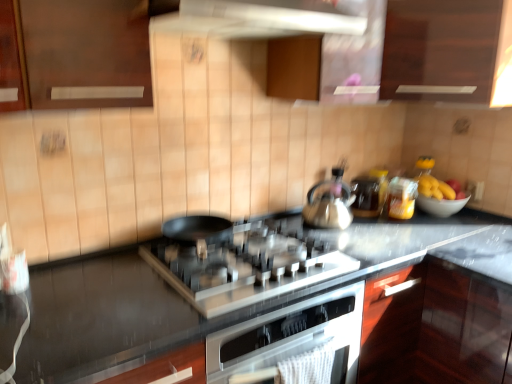
In order to face white glossy bowl at right, should I rotate leftwards or rightwards?

To face it directly, rotate right by 23.308 degrees.

Locate an element on the screen. satin silver gas stove at center is located at coordinates (246, 266).

The image size is (512, 384). What do you see at coordinates (367, 45) in the screenshot?
I see `wooden cabinet at upper center, which is counted as the second cabinetry, starting from the right` at bounding box center [367, 45].

This screenshot has height=384, width=512. Describe the element at coordinates (402, 198) in the screenshot. I see `matte yellow jar at upper right, the 2th appliance in the left-to-right sequence` at that location.

Describe the element at coordinates (330, 203) in the screenshot. I see `satin silver kettle at center` at that location.

How much space does matte glass jar at center, acting as the first appliance starting from the left, occupy horizontally?

The width of matte glass jar at center, acting as the first appliance starting from the left, is 6.06 inches.

At what (x,y) coordinates should I click in order to perform the action: click on white glossy bowl at right. Please return your answer as a coordinate pair (x, y). Image resolution: width=512 pixels, height=384 pixels. Looking at the image, I should click on (441, 205).

Between point (290, 250) and point (83, 63), which one is positioned behind?

The point (290, 250) is behind.

Identify the location of gas stove lying below the wooden cabinet at upper center, which is counted as the second cabinetry, starting from the right (from the image's perspective). Image resolution: width=512 pixels, height=384 pixels. tap(246, 266).

From the image's perspective, which is above, satin silver gas stove at center or wooden cabinet at upper center, the 1th cabinetry viewed from the left?

wooden cabinet at upper center, the 1th cabinetry viewed from the left.

Is satin silver gas stove at center to the left or to the right of wooden cabinet at upper center, which is counted as the second cabinetry, starting from the right, in the image?

satin silver gas stove at center is to the right of wooden cabinet at upper center, which is counted as the second cabinetry, starting from the right.

Considering the sizes of dark wood cabinet at upper center, acting as the 2th cabinetry starting from the left, and white glossy exhaust hood at upper center in the image, is dark wood cabinet at upper center, acting as the 2th cabinetry starting from the left, wider or thinner than white glossy exhaust hood at upper center?

Considering their sizes, dark wood cabinet at upper center, acting as the 2th cabinetry starting from the left, looks broader than white glossy exhaust hood at upper center.

Is white glossy exhaust hood at upper center located within dark wood cabinet at upper center, acting as the 2th cabinetry starting from the left?

That's incorrect, white glossy exhaust hood at upper center is not inside dark wood cabinet at upper center, acting as the 2th cabinetry starting from the left.

Considering the positions of points (423, 30) and (181, 16), is point (423, 30) closer to camera compared to point (181, 16)?

That is False.

Is dark wood cabinet at upper center, acting as the 2th cabinetry starting from the left, beside wooden cabinet at upper center, which is counted as the second cabinetry, starting from the right?

Yes, dark wood cabinet at upper center, acting as the 2th cabinetry starting from the left, and wooden cabinet at upper center, which is counted as the second cabinetry, starting from the right, clearly make contact.

From the image's perspective, is dark wood cabinet at upper center, acting as the 2th cabinetry starting from the left, positioned above or below wooden cabinet at upper center, the 1th cabinetry viewed from the left?

dark wood cabinet at upper center, acting as the 2th cabinetry starting from the left, is situated higher than wooden cabinet at upper center, the 1th cabinetry viewed from the left, in the image.

Looking at this image, how different are the orientations of dark wood cabinet at upper center, acting as the 2th cabinetry starting from the left, and wooden cabinet at upper center, the 1th cabinetry viewed from the left, in degrees?

The angle between the facing direction of dark wood cabinet at upper center, acting as the 2th cabinetry starting from the left, and the facing direction of wooden cabinet at upper center, the 1th cabinetry viewed from the left, is 2.08e-05 degrees.

Is dark wood cabinet at upper center, acting as the first cabinetry starting from the right, positioned with its back to wooden cabinet at upper center, which is counted as the second cabinetry, starting from the right?

That's not correct — dark wood cabinet at upper center, acting as the first cabinetry starting from the right, is not looking away from wooden cabinet at upper center, which is counted as the second cabinetry, starting from the right.

Which object is thinner, white glossy bowl at right or dark wood cabinet at upper center, acting as the first cabinetry starting from the right?

white glossy bowl at right is thinner.

From a real-world perspective, which is physically below, white glossy bowl at right or dark wood cabinet at upper center, acting as the first cabinetry starting from the right?

white glossy bowl at right, from a real-world perspective.

Considering the positions of point (420, 200) and point (305, 86), is point (420, 200) closer or farther from the camera than point (305, 86)?

Point (420, 200) appears to be farther away from the viewer than point (305, 86).

Is white glossy bowl at right facing away from dark wood cabinet at upper center, acting as the 2th cabinetry starting from the left?

No.

Between matte glass jar at center, which is counted as the 2th appliance, starting from the right, and white glossy bowl at right, which one has less height?

With less height is white glossy bowl at right.

Is matte glass jar at center, acting as the first appliance starting from the left, next to white glossy bowl at right and touching it?

No, matte glass jar at center, acting as the first appliance starting from the left, is not beside white glossy bowl at right.

Is matte glass jar at center, acting as the first appliance starting from the left, looking in the opposite direction of white glossy bowl at right?

matte glass jar at center, acting as the first appliance starting from the left, does not have its back to white glossy bowl at right.

You are a GUI agent. You are given a task and a screenshot of the screen. Output one action in this format:
    pyautogui.click(x=<x>, y=<y>)
    Task: Click on the 2nd appliance counting from the left side of the white glossy bowl at right
    The height and width of the screenshot is (384, 512).
    Given the screenshot: What is the action you would take?
    pyautogui.click(x=366, y=196)

Is matte yellow jar at upper right, the 2th appliance in the left-to-right sequence, taller than satin silver kettle at center?

Yes.

The image size is (512, 384). What are the coordinates of `kitchen appliance that is on the left side of matte yellow jar at upper right, which is the first appliance in right-to-left order` in the screenshot? It's located at (330, 203).

From a real-world perspective, is matte yellow jar at upper right, the 2th appliance in the left-to-right sequence, located beneath satin silver kettle at center?

Yes, from a real-world perspective, matte yellow jar at upper right, the 2th appliance in the left-to-right sequence, is beneath satin silver kettle at center.

Considering the relative sizes of matte yellow jar at upper right, which is the first appliance in right-to-left order, and satin silver kettle at center in the image provided, is matte yellow jar at upper right, which is the first appliance in right-to-left order, smaller than satin silver kettle at center?

Indeed, matte yellow jar at upper right, which is the first appliance in right-to-left order, has a smaller size compared to satin silver kettle at center.

Can you tell me how much wooden cabinet at upper center, the 1th cabinetry viewed from the left, and matte yellow jar at upper right, which is the first appliance in right-to-left order, differ in facing direction?

There is a 6.5-degree angle between the facing directions of wooden cabinet at upper center, the 1th cabinetry viewed from the left, and matte yellow jar at upper right, which is the first appliance in right-to-left order.

Considering the sizes of objects wooden cabinet at upper center, which is counted as the second cabinetry, starting from the right, and matte yellow jar at upper right, which is the first appliance in right-to-left order, in the image provided, who is smaller, wooden cabinet at upper center, which is counted as the second cabinetry, starting from the right, or matte yellow jar at upper right, which is the first appliance in right-to-left order,?

Smaller between the two is matte yellow jar at upper right, which is the first appliance in right-to-left order.

Is wooden cabinet at upper center, which is counted as the second cabinetry, starting from the right, taller than matte yellow jar at upper right, the 2th appliance in the left-to-right sequence?

Yes.

Is wooden cabinet at upper center, the 1th cabinetry viewed from the left, turned away from matte yellow jar at upper right, which is the first appliance in right-to-left order?

That's not correct — wooden cabinet at upper center, the 1th cabinetry viewed from the left, is not looking away from matte yellow jar at upper right, which is the first appliance in right-to-left order.

The height and width of the screenshot is (384, 512). I want to click on gas stove on the right of wooden cabinet at upper center, which is counted as the second cabinetry, starting from the right, so click(x=246, y=266).

Find the location of `cabinetry that is behind the white glossy exhaust hood at upper center`. cabinetry that is behind the white glossy exhaust hood at upper center is located at coordinates (441, 49).

From the image, which object appears to be farther from satin silver kettle at center, white glossy exhaust hood at upper center or matte glass jar at center, which is counted as the 2th appliance, starting from the right?

white glossy exhaust hood at upper center.

From the image, which object appears to be farther from wooden cabinet at upper center, which is counted as the second cabinetry, starting from the right, dark wood cabinet at upper center, acting as the first cabinetry starting from the right, or white glossy bowl at right?

Among the two, white glossy bowl at right is located further to wooden cabinet at upper center, which is counted as the second cabinetry, starting from the right.

Based on their spatial positions, is dark wood cabinet at upper center, acting as the 2th cabinetry starting from the left, or white glossy exhaust hood at upper center further from satin silver kettle at center?

white glossy exhaust hood at upper center is further to satin silver kettle at center.

Which object lies further to the anchor point matte yellow jar at upper right, the 2th appliance in the left-to-right sequence, matte glass jar at center, which is counted as the 2th appliance, starting from the right, or satin silver kettle at center?

Among the two, satin silver kettle at center is located further to matte yellow jar at upper right, the 2th appliance in the left-to-right sequence.

Looking at the image, which one is located closer to matte glass jar at center, which is counted as the 2th appliance, starting from the right, satin silver gas stove at center or white glossy exhaust hood at upper center?

satin silver gas stove at center lies closer to matte glass jar at center, which is counted as the 2th appliance, starting from the right, than the other object.

Estimate the real-world distances between objects in this image. Which object is closer to satin silver gas stove at center, white glossy bowl at right or satin silver kettle at center?

Based on the image, satin silver kettle at center appears to be nearer to satin silver gas stove at center.

Considering their positions, is satin silver kettle at center positioned further to matte glass jar at center, acting as the first appliance starting from the left, than wooden cabinet at upper center, which is counted as the second cabinetry, starting from the right?

Based on the image, wooden cabinet at upper center, which is counted as the second cabinetry, starting from the right, appears to be further to matte glass jar at center, acting as the first appliance starting from the left.

Estimate the real-world distances between objects in this image. Which object is closer to satin silver gas stove at center, white glossy exhaust hood at upper center or matte glass jar at center, acting as the first appliance starting from the left?

The object closer to satin silver gas stove at center is white glossy exhaust hood at upper center.

At what (x,y) coordinates should I click in order to perform the action: click on cabinetry located between satin silver gas stove at center and matte glass jar at center, which is counted as the 2th appliance, starting from the right, in the depth direction. Please return your answer as a coordinate pair (x, y). Image resolution: width=512 pixels, height=384 pixels. Looking at the image, I should click on (441, 49).

Where is `bowl positioned between wooden cabinet at upper center, the 1th cabinetry viewed from the left, and matte glass jar at center, acting as the first appliance starting from the left, from near to far`? Image resolution: width=512 pixels, height=384 pixels. bowl positioned between wooden cabinet at upper center, the 1th cabinetry viewed from the left, and matte glass jar at center, acting as the first appliance starting from the left, from near to far is located at coordinates (441, 205).

This screenshot has width=512, height=384. In order to click on kitchen appliance positioned between wooden cabinet at upper center, the 1th cabinetry viewed from the left, and white glossy bowl at right from near to far in this screenshot , I will do `click(330, 203)`.

Where is `kitchen appliance between wooden cabinet at upper center, the 1th cabinetry viewed from the left, and matte yellow jar at upper right, the 2th appliance in the left-to-right sequence, along the z-axis`? kitchen appliance between wooden cabinet at upper center, the 1th cabinetry viewed from the left, and matte yellow jar at upper right, the 2th appliance in the left-to-right sequence, along the z-axis is located at coordinates (330, 203).